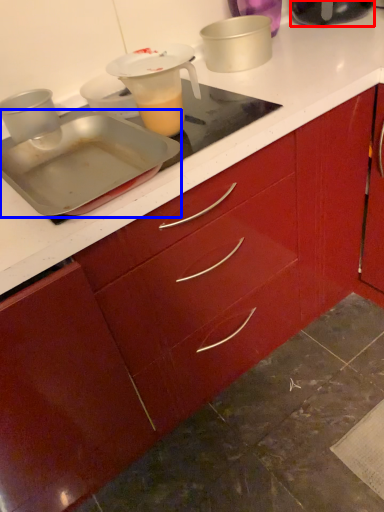
Question: Among these objects, which one is farthest to the camera, kitchen appliance (highlighted by a red box) or kitchen appliance (highlighted by a blue box)?

Choices:
 (A) kitchen appliance
 (B) kitchen appliance

Answer: (A)